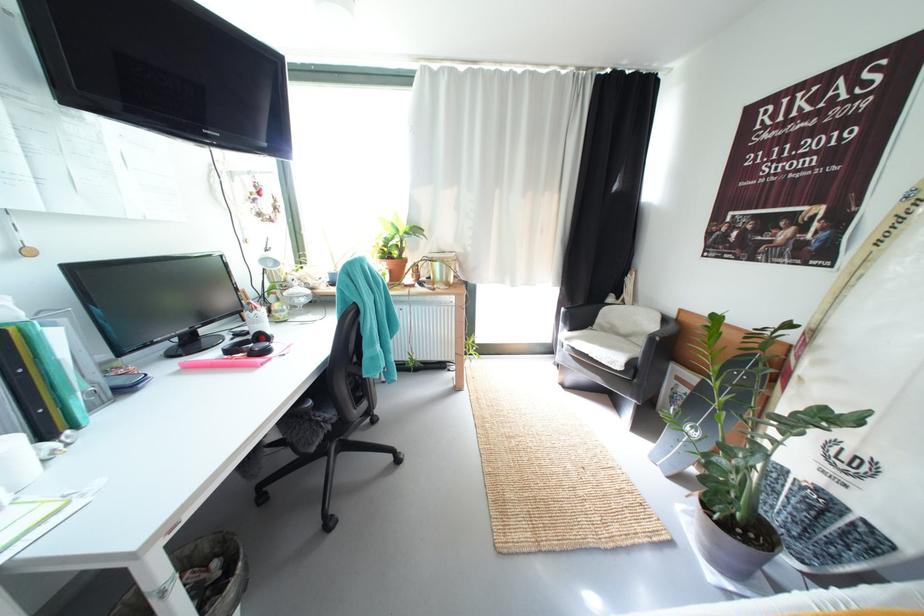
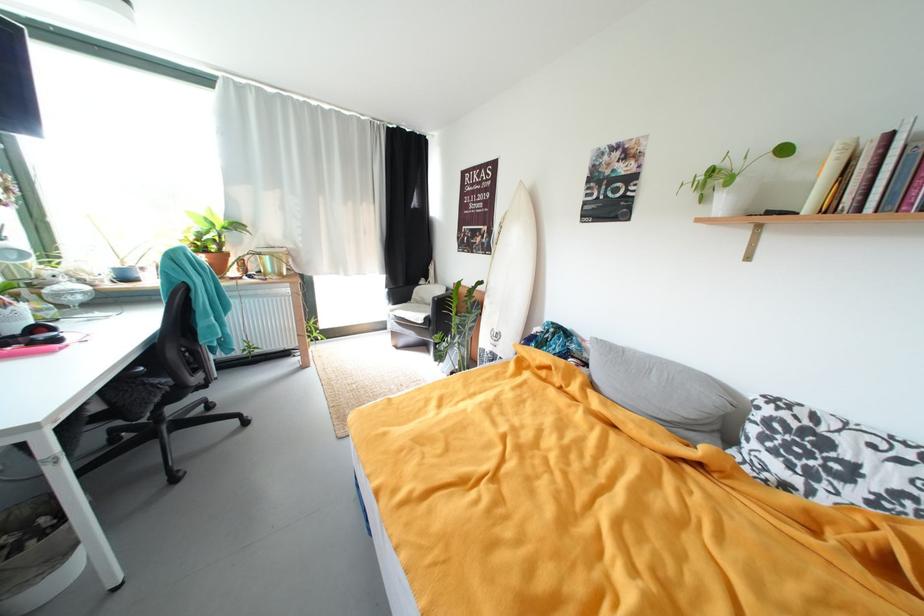
Where in the second image is the point corresponding to the point at 848,222 from the first image?

(497, 235)